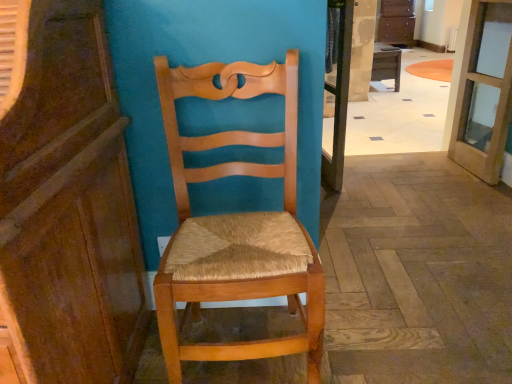
Question: Considering the relative sizes of polished wood floor at center and wooden desk at center in the image provided, is polished wood floor at center wider than wooden desk at center?

Choices:
 (A) no
 (B) yes

Answer: (A)

Question: Is polished wood floor at center next to wooden desk at center and touching it?

Choices:
 (A) yes
 (B) no

Answer: (B)

Question: Is wooden desk at center at the back of polished wood floor at center?

Choices:
 (A) no
 (B) yes

Answer: (B)

Question: Is polished wood floor at center closer to camera compared to wooden desk at center?

Choices:
 (A) yes
 (B) no

Answer: (A)

Question: From the image's perspective, is polished wood floor at center located beneath wooden desk at center?

Choices:
 (A) yes
 (B) no

Answer: (A)

Question: From the image's perspective, is clear glass screen door at center located above or below clear glass door at upper right?

Choices:
 (A) below
 (B) above

Answer: (A)

Question: Is clear glass screen door at center bigger or smaller than clear glass door at upper right?

Choices:
 (A) big
 (B) small

Answer: (B)

Question: Is point (344, 104) closer or farther from the camera than point (503, 0)?

Choices:
 (A) farther
 (B) closer

Answer: (A)

Question: Choose the correct answer: Is clear glass screen door at center inside clear glass door at upper right or outside it?

Choices:
 (A) outside
 (B) inside

Answer: (A)

Question: In terms of height, does wooden cabinet at left look taller or shorter compared to polished wood floor at center?

Choices:
 (A) tall
 (B) short

Answer: (A)

Question: Do you think wooden cabinet at left is within polished wood floor at center, or outside of it?

Choices:
 (A) outside
 (B) inside

Answer: (A)

Question: Considering the positions of wooden cabinet at left and polished wood floor at center in the image, is wooden cabinet at left bigger or smaller than polished wood floor at center?

Choices:
 (A) big
 (B) small

Answer: (A)

Question: In the image, is wooden cabinet at left positioned in front of or behind polished wood floor at center?

Choices:
 (A) behind
 (B) front

Answer: (B)

Question: Which is correct: clear glass door at upper right is inside wooden desk at center, or outside of it?

Choices:
 (A) inside
 (B) outside

Answer: (B)

Question: Is clear glass door at upper right wider or thinner than wooden desk at center?

Choices:
 (A) wide
 (B) thin

Answer: (B)